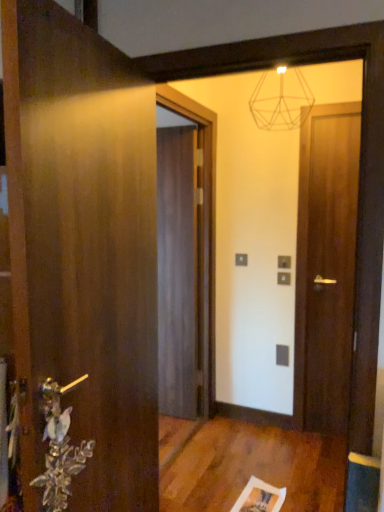
Question: Would you say silver metallic door handle at lower left is outside dark wood door at center, placed as the first door when sorted from back to front?

Choices:
 (A) no
 (B) yes

Answer: (B)

Question: Is silver metallic door handle at lower left positioned behind dark wood door at center, the second door positioned from the right?

Choices:
 (A) yes
 (B) no

Answer: (B)

Question: Does silver metallic door handle at lower left contain dark wood door at center, the second door positioned from the right?

Choices:
 (A) yes
 (B) no

Answer: (B)

Question: Is silver metallic door handle at lower left thinner than dark wood door at center, placed as the second door when sorted from left to right?

Choices:
 (A) yes
 (B) no

Answer: (A)

Question: Considering the relative sizes of silver metallic door handle at lower left and dark wood door at center, the second door positioned from the right, in the image provided, is silver metallic door handle at lower left taller than dark wood door at center, the second door positioned from the right,?

Choices:
 (A) no
 (B) yes

Answer: (A)

Question: Is silver metallic door handle at lower left to the left of dark wood door at center, the second door positioned from the right, from the viewer's perspective?

Choices:
 (A) no
 (B) yes

Answer: (B)

Question: Can you confirm if dark wood door at center, the second door positioned from the right, is taller than silver metallic door handle at lower left?

Choices:
 (A) no
 (B) yes

Answer: (B)

Question: Is dark wood door at center, which is the third door in front-to-back order, to the left of silver metallic door handle at lower left from the viewer's perspective?

Choices:
 (A) yes
 (B) no

Answer: (B)

Question: Would you say silver metallic door handle at lower left is part of dark wood door at center, which is the third door in front-to-back order,'s contents?

Choices:
 (A) no
 (B) yes

Answer: (A)

Question: From a real-world perspective, is dark wood door at center, placed as the first door when sorted from back to front, over silver metallic door handle at lower left?

Choices:
 (A) yes
 (B) no

Answer: (A)

Question: Can we say dark wood door at center, which is the third door in front-to-back order, lies outside silver metallic door handle at lower left?

Choices:
 (A) no
 (B) yes

Answer: (B)

Question: Can you confirm if dark wood door at center, the second door positioned from the right, is smaller than silver metallic door handle at lower left?

Choices:
 (A) no
 (B) yes

Answer: (A)

Question: Does silver metallic door handle at lower left have a greater width compared to wooden door at left, the 3th door when ordered from back to front?

Choices:
 (A) yes
 (B) no

Answer: (B)